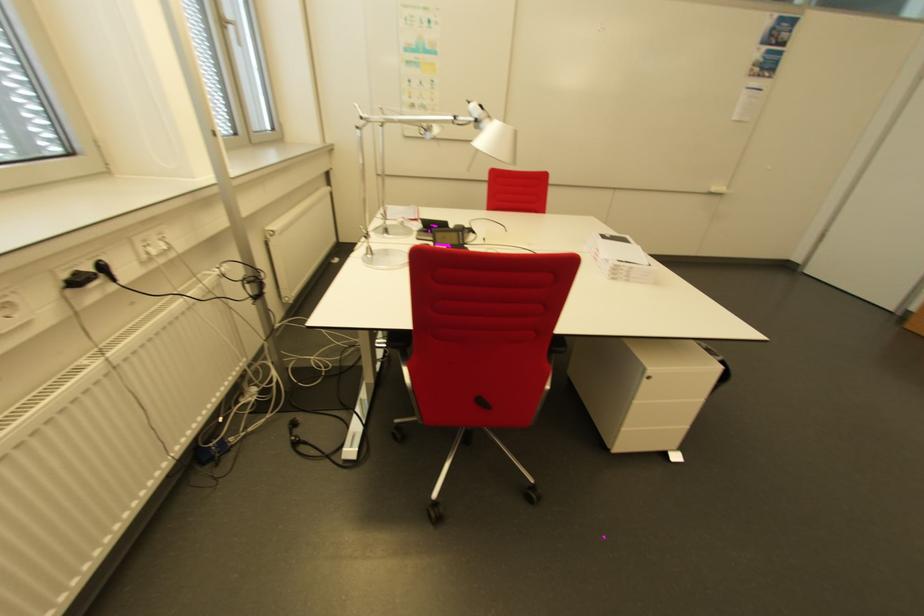
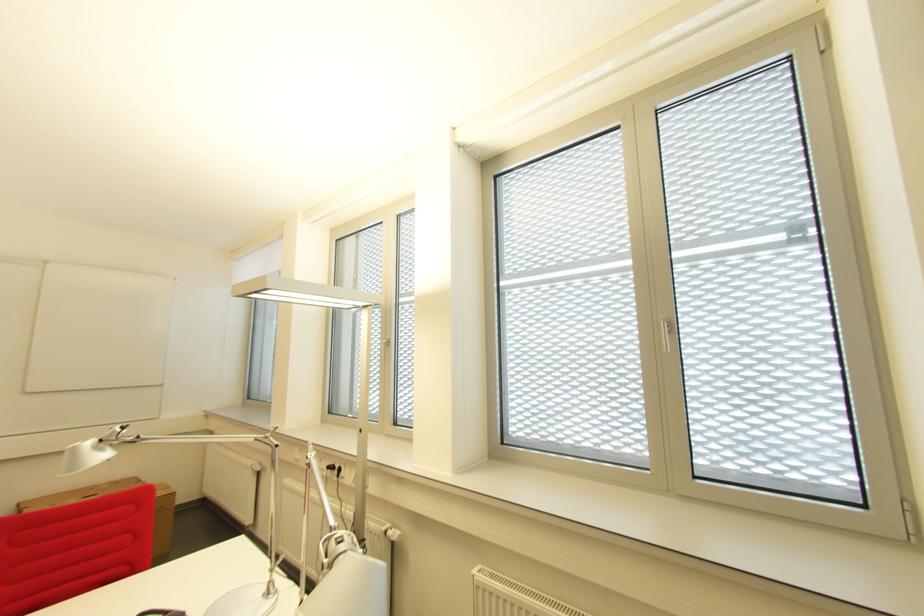
Find the pixel in the second image that matches [82,283] in the first image.

(337, 469)